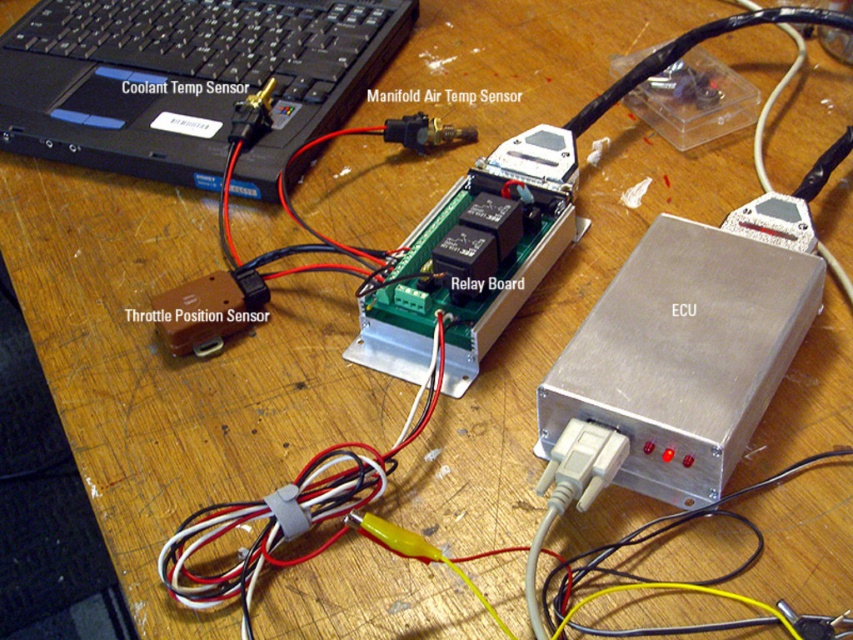
Looking at this image, you are standing 1 meter away from the table. Is the point at coordinates point (113, 93) within your reach without moving your feet?

The point at coordinates point (113, 93) is 86.36 centimeters away from the camera. Since you are standing 1 meter away from the table, the distance to the point is within your reach without moving your feet.